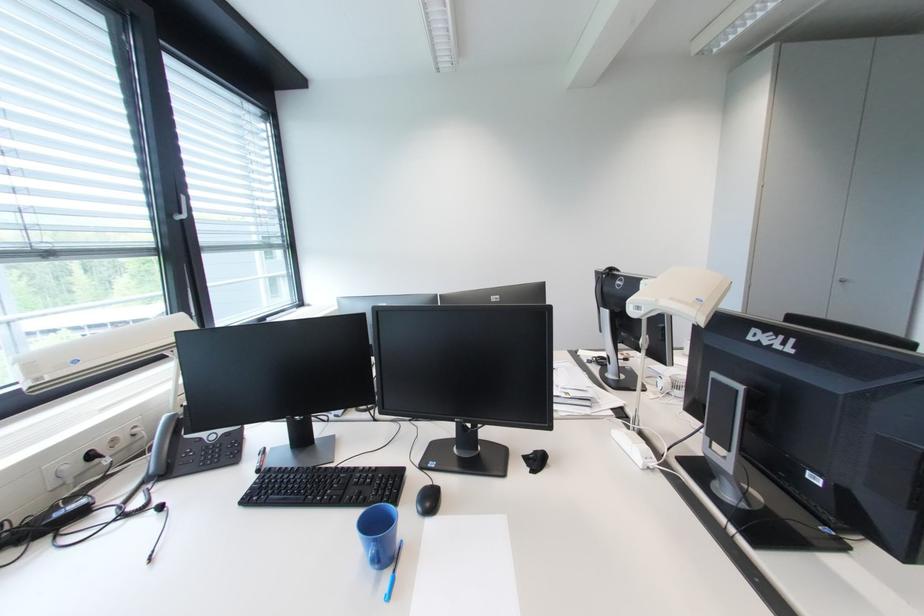
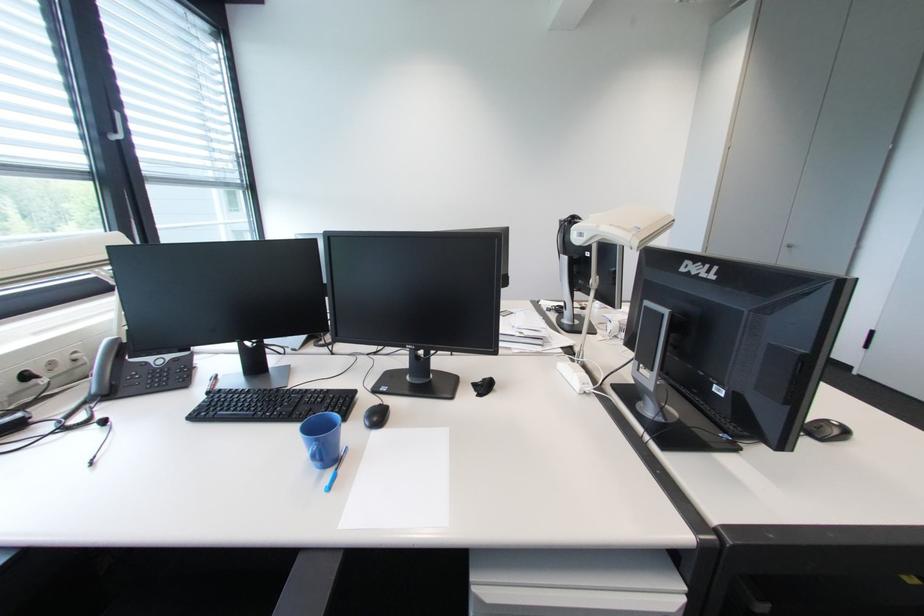
Question: The images are taken continuously from a first-person perspective. In which direction are you moving?

Choices:
 (A) Left
 (B) Right
 (C) Forward
 (D) Backward

Answer: (B)